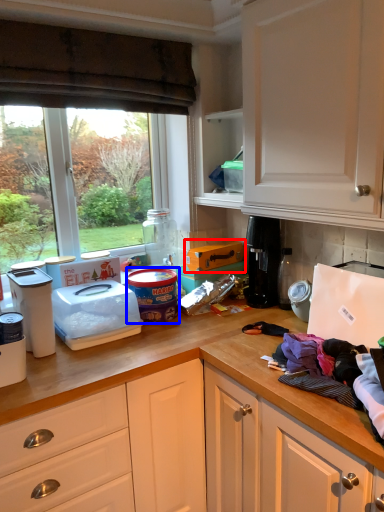
Question: Which object appears closest to the camera in this image, cardboard box (highlighted by a red box) or appliance (highlighted by a blue box)?

Choices:
 (A) cardboard box
 (B) appliance

Answer: (B)